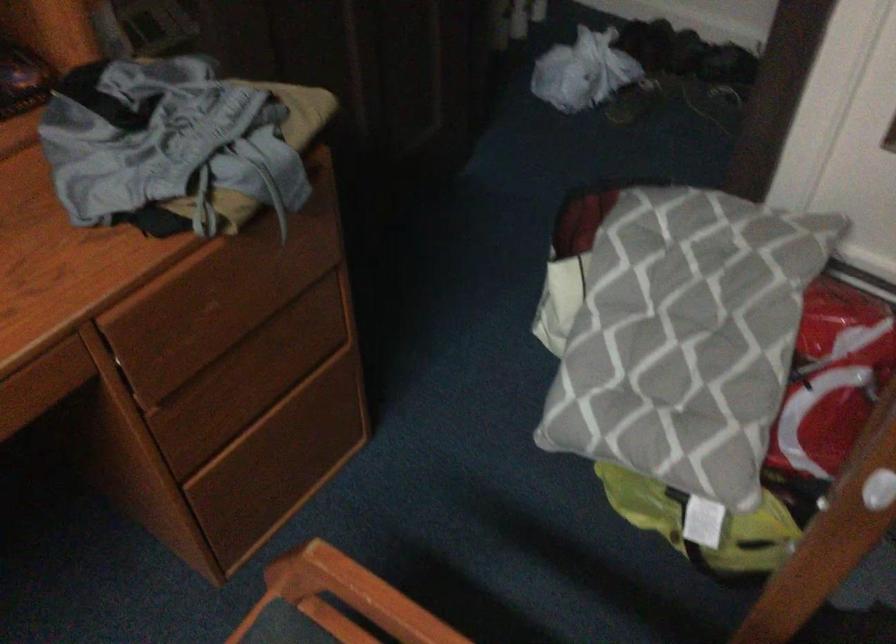
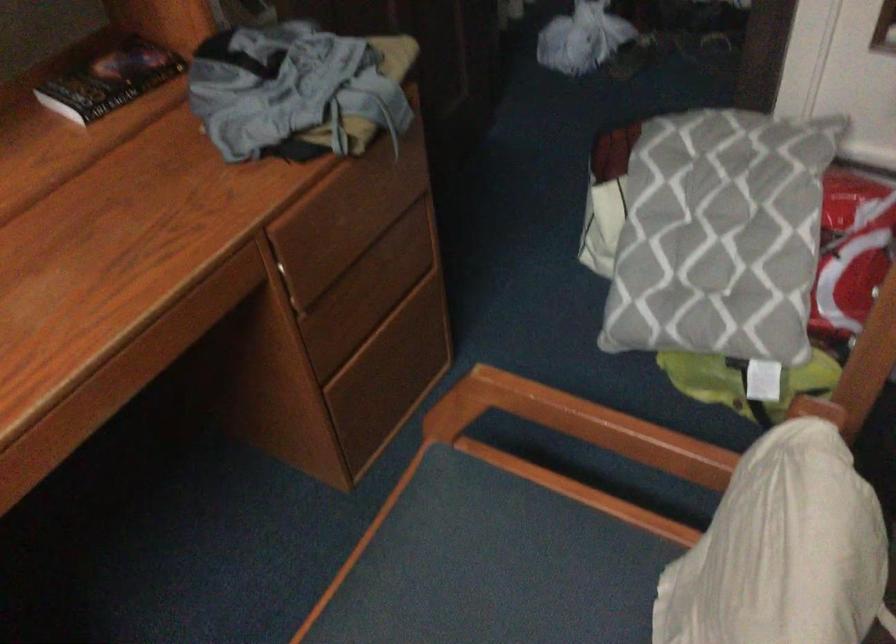
The point at [151,366] is marked in the first image. Where is the corresponding point in the second image?

(299, 276)